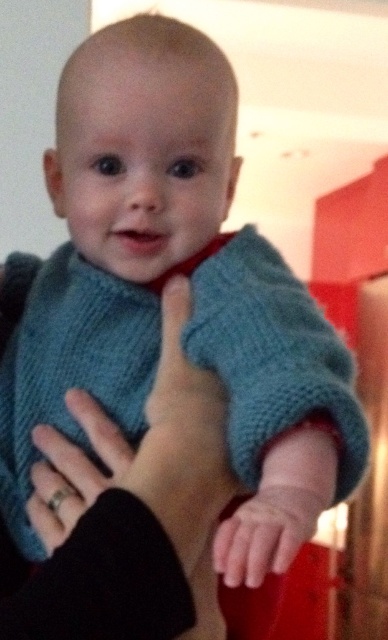
Does silver metallic ring at lower left have a greater width compared to smooth skin hand at center?

Correct, the width of silver metallic ring at lower left exceeds that of smooth skin hand at center.

Between silver metallic ring at lower left and smooth skin hand at center, which one has more height?

With more height is silver metallic ring at lower left.

At what (x,y) coordinates should I click in order to perform the action: click on silver metallic ring at lower left. Please return your answer as a coordinate pair (x, y). Looking at the image, I should click on (74, 468).